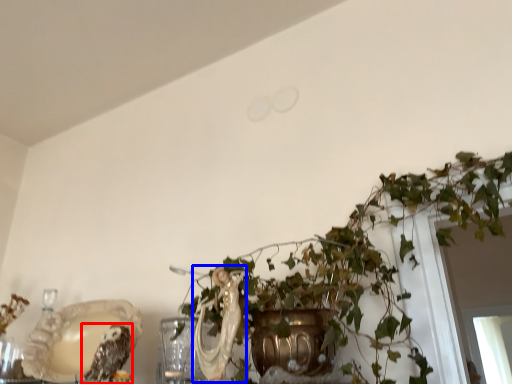
Question: Which point is closer to the camera, owl (highlighted by a red box) or animal (highlighted by a blue box)?

Choices:
 (A) owl
 (B) animal

Answer: (B)